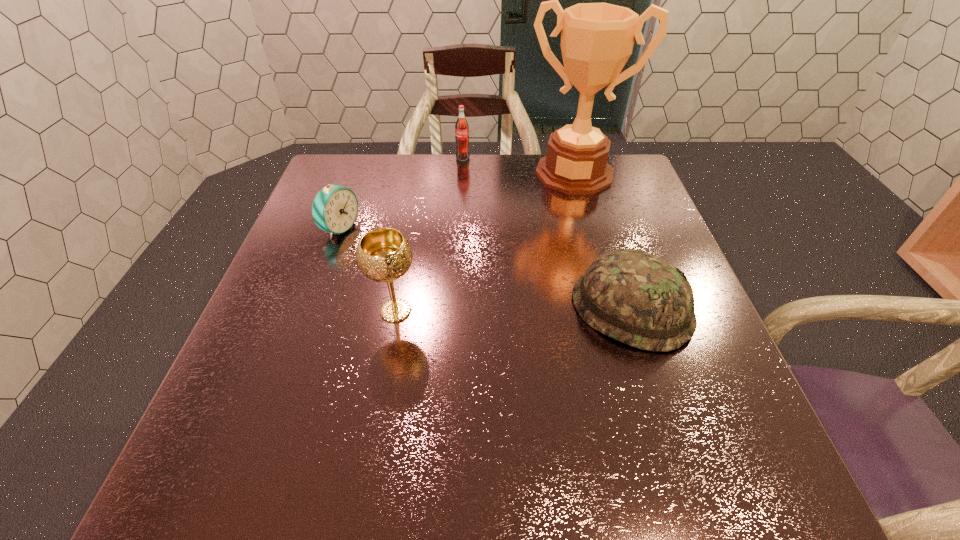
What are the coordinates of `free space that satisfies the following two spatial constraints: 1. on the back side of the leftmost object; 2. on the right side of the soda bottle` in the screenshot? It's located at (365, 158).